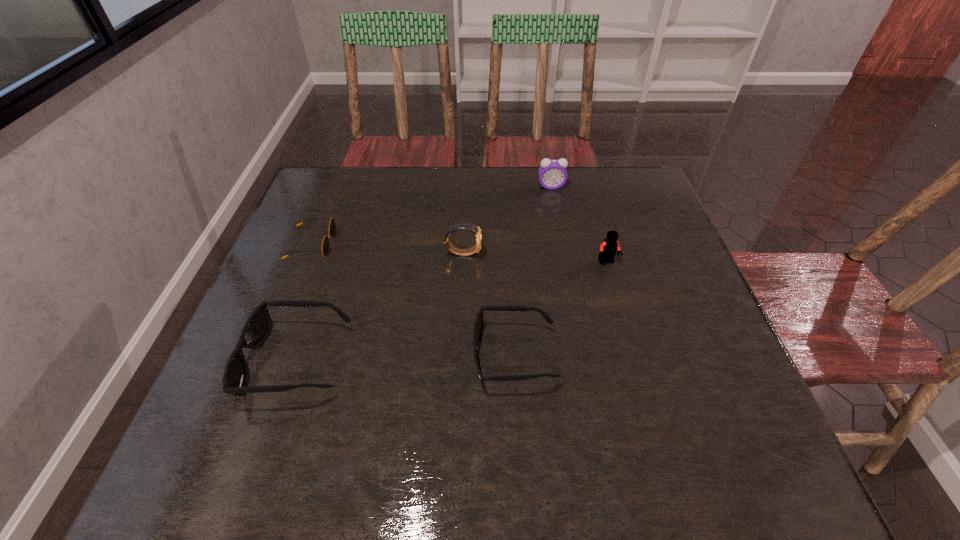
This screenshot has height=540, width=960. I want to click on the tallest sunglasses, so click(x=256, y=329).

The image size is (960, 540). In order to click on the second shortest sunglasses in this screenshot , I will do `click(478, 331)`.

Find the location of a particular element. The height and width of the screenshot is (540, 960). the second shortest object is located at coordinates (478, 331).

I want to click on the second object from right to left, so click(x=552, y=173).

I want to click on the farthest object, so click(x=552, y=173).

At what (x,y) coordinates should I click in order to perform the action: click on the shortest object. Please return your answer as a coordinate pair (x, y). This screenshot has width=960, height=540. Looking at the image, I should click on (332, 225).

Locate an element on the screen. Image resolution: width=960 pixels, height=540 pixels. the farthest sunglasses is located at coordinates (332, 225).

Where is `watch`? This screenshot has height=540, width=960. watch is located at coordinates (467, 226).

Identify the location of Lego. (608, 249).

The height and width of the screenshot is (540, 960). I want to click on free space located on the front-facing side of the second shortest object, so click(x=404, y=356).